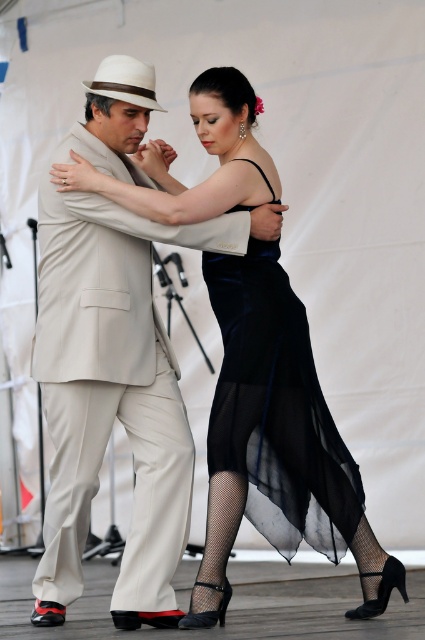
Based on the scene description, which object has a greater width between the beige fabric suit at center and the velvet black dress at center?

The beige fabric suit at center has a greater width than the velvet black dress at center according to the description.